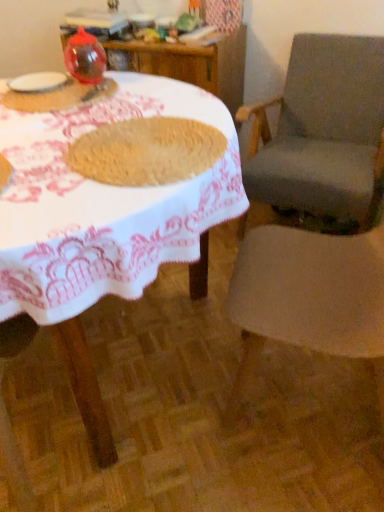
Where is `gray fabric chair at right, acting as the 1th chair starting from the front`? The image size is (384, 512). gray fabric chair at right, acting as the 1th chair starting from the front is located at coordinates (306, 295).

Identify the location of gray fabric chair at right, marked as the first chair in a back-to-front arrangement. This screenshot has width=384, height=512. (321, 129).

What is the approximate width of white woven table at center?

The width of white woven table at center is 1.21 meters.

Consider the image. Measure the distance between point (68, 61) and camera.

5.05 feet.

The image size is (384, 512). I want to click on translucent plastic cup at upper left, which appears as the first tableware when ordered from the bottom, so click(x=59, y=96).

From a real-world perspective, which object stands above the other?

transparent plastic balloon at upper left, which is counted as the 1th tableware, starting from the top, from a real-world perspective.

Considering the points (280, 98) and (97, 64), which point is in front, point (280, 98) or point (97, 64)?

The point (97, 64) is closer.

Is gray fabric chair at right, which ranks as the 2th chair in front-to-back order, facing towards transparent plastic balloon at upper left, placed as the third tableware when sorted from bottom to top?

No, gray fabric chair at right, which ranks as the 2th chair in front-to-back order, is not oriented towards transparent plastic balloon at upper left, placed as the third tableware when sorted from bottom to top.

Is white matte plate at upper left, marked as the 2th tableware in a bottom-to-top arrangement, directly adjacent to transparent plastic balloon at upper left, which is counted as the 1th tableware, starting from the top?

white matte plate at upper left, marked as the 2th tableware in a bottom-to-top arrangement, and transparent plastic balloon at upper left, which is counted as the 1th tableware, starting from the top, are clearly separated.

Between white matte plate at upper left, which is the 2th tableware from top to bottom, and transparent plastic balloon at upper left, which is counted as the 1th tableware, starting from the top, which one is positioned in front?

transparent plastic balloon at upper left, which is counted as the 1th tableware, starting from the top.

Is white matte plate at upper left, which is the 2th tableware from top to bottom, positioned with its back to transparent plastic balloon at upper left, placed as the third tableware when sorted from bottom to top?

Yes, transparent plastic balloon at upper left, placed as the third tableware when sorted from bottom to top, is at the back of white matte plate at upper left, which is the 2th tableware from top to bottom.

From the image's perspective, is translucent plastic cup at upper left, the 3th tableware in the top-to-bottom sequence, under gray fabric chair at right, marked as the first chair in a back-to-front arrangement?

No, from the image's perspective, translucent plastic cup at upper left, the 3th tableware in the top-to-bottom sequence, is not below gray fabric chair at right, marked as the first chair in a back-to-front arrangement.

Find the location of a particular element. the 1st tableware positioned above the gray fabric chair at right, marked as the first chair in a back-to-front arrangement (from a real-world perspective) is located at coordinates (59, 96).

Is point (10, 98) farther from camera compared to point (293, 118)?

No.

Between translucent plastic cup at upper left, which appears as the first tableware when ordered from the bottom, and gray fabric chair at right, marked as the first chair in a back-to-front arrangement, which one has smaller size?

translucent plastic cup at upper left, which appears as the first tableware when ordered from the bottom.

From the picture: Is brown woven mat at center facing towards gray fabric chair at right, which ranks as the 2th chair in front-to-back order?

No.

Consider the image. Considering the relative positions of brown woven mat at center and gray fabric chair at right, marked as the first chair in a back-to-front arrangement, in the image provided, is brown woven mat at center in front of gray fabric chair at right, marked as the first chair in a back-to-front arrangement,?

That is True.

Can you confirm if brown woven mat at center is positioned to the right of gray fabric chair at right, marked as the first chair in a back-to-front arrangement?

In fact, brown woven mat at center is to the left of gray fabric chair at right, marked as the first chair in a back-to-front arrangement.

Is brown woven mat at center bigger than gray fabric chair at right, marked as the first chair in a back-to-front arrangement?

Actually, brown woven mat at center might be smaller than gray fabric chair at right, marked as the first chair in a back-to-front arrangement.

Looking at their sizes, would you say transparent plastic balloon at upper left, which is counted as the 1th tableware, starting from the top, is wider or thinner than white woven table at center?

Clearly, transparent plastic balloon at upper left, which is counted as the 1th tableware, starting from the top, has less width compared to white woven table at center.

Between transparent plastic balloon at upper left, placed as the third tableware when sorted from bottom to top, and white woven table at center, which one has less height?

With less height is transparent plastic balloon at upper left, placed as the third tableware when sorted from bottom to top.

Is transparent plastic balloon at upper left, which is counted as the 1th tableware, starting from the top, situated inside white woven table at center or outside?

transparent plastic balloon at upper left, which is counted as the 1th tableware, starting from the top, is outside white woven table at center.

There is a white woven table at center. Where is `the 3rd tableware above it (from the image's perspective)`? the 3rd tableware above it (from the image's perspective) is located at coordinates (85, 57).

Looking at their sizes, would you say brown woven mat at center is wider or thinner than gray fabric chair at right, acting as the 1th chair starting from the front?

brown woven mat at center is thinner than gray fabric chair at right, acting as the 1th chair starting from the front.

Based on the photo, can you tell me how much brown woven mat at center and gray fabric chair at right, acting as the 1th chair starting from the front, differ in facing direction?

They differ by 1.41 degrees in their facing directions.

From a real-world perspective, who is located lower, brown woven mat at center or gray fabric chair at right, acting as the 1th chair starting from the front?

In real-world perspective, gray fabric chair at right, acting as the 1th chair starting from the front, is lower.

Is brown woven mat at center not close to gray fabric chair at right, the 2th chair when ordered from back to front?

No, brown woven mat at center is in close proximity to gray fabric chair at right, the 2th chair when ordered from back to front.

Which object is thinner, translucent plastic cup at upper left, the 3th tableware in the top-to-bottom sequence, or brown woven mat at center?

brown woven mat at center is thinner.

Is point (32, 103) closer to camera compared to point (81, 169)?

No, (32, 103) is further to viewer.

Locate an element on the screen. The width and height of the screenshot is (384, 512). food below the translucent plastic cup at upper left, the 3th tableware in the top-to-bottom sequence (from the image's perspective) is located at coordinates (146, 151).

Looking at this image, from the image's perspective, which is above, translucent plastic cup at upper left, the 3th tableware in the top-to-bottom sequence, or brown woven mat at center?

translucent plastic cup at upper left, the 3th tableware in the top-to-bottom sequence, appears higher in the image.

Where is `the 2nd chair positioned below the transparent plastic balloon at upper left, placed as the third tableware when sorted from bottom to top (from a real-world perspective)`? This screenshot has width=384, height=512. the 2nd chair positioned below the transparent plastic balloon at upper left, placed as the third tableware when sorted from bottom to top (from a real-world perspective) is located at coordinates (321, 129).

Where is `tableware above the white matte plate at upper left, marked as the 2th tableware in a bottom-to-top arrangement (from a real-world perspective)`? tableware above the white matte plate at upper left, marked as the 2th tableware in a bottom-to-top arrangement (from a real-world perspective) is located at coordinates (85, 57).

Estimate the real-world distances between objects in this image. Which object is closer to brown woven mat at center, transparent plastic balloon at upper left, placed as the third tableware when sorted from bottom to top, or white matte plate at upper left, marked as the 2th tableware in a bottom-to-top arrangement?

transparent plastic balloon at upper left, placed as the third tableware when sorted from bottom to top, is positioned closer to the anchor brown woven mat at center.

Which object lies further to the anchor point gray fabric chair at right, the 2th chair when ordered from back to front, gray fabric chair at right, which ranks as the 2th chair in front-to-back order, or translucent plastic cup at upper left, the 3th tableware in the top-to-bottom sequence?

The object further to gray fabric chair at right, the 2th chair when ordered from back to front, is translucent plastic cup at upper left, the 3th tableware in the top-to-bottom sequence.

Considering their positions, is gray fabric chair at right, the 2th chair when ordered from back to front, positioned further to white woven table at center than transparent plastic balloon at upper left, which is counted as the 1th tableware, starting from the top?

transparent plastic balloon at upper left, which is counted as the 1th tableware, starting from the top, is positioned further to the anchor white woven table at center.

Considering their positions, is white matte plate at upper left, which is the 2th tableware from top to bottom, positioned further to gray fabric chair at right, which ranks as the 2th chair in front-to-back order, than transparent plastic balloon at upper left, which is counted as the 1th tableware, starting from the top?

white matte plate at upper left, which is the 2th tableware from top to bottom, is further to gray fabric chair at right, which ranks as the 2th chair in front-to-back order.

In the scene shown: Which object lies further to the anchor point white matte plate at upper left, marked as the 2th tableware in a bottom-to-top arrangement, transparent plastic balloon at upper left, placed as the third tableware when sorted from bottom to top, or translucent plastic cup at upper left, which appears as the first tableware when ordered from the bottom?

transparent plastic balloon at upper left, placed as the third tableware when sorted from bottom to top, is positioned further to the anchor white matte plate at upper left, marked as the 2th tableware in a bottom-to-top arrangement.

Which object lies nearer to the anchor point white woven table at center, gray fabric chair at right, which ranks as the 2th chair in front-to-back order, or white matte plate at upper left, which is the 2th tableware from top to bottom?

white matte plate at upper left, which is the 2th tableware from top to bottom.

When comparing their distances from translucent plastic cup at upper left, which appears as the first tableware when ordered from the bottom, does white woven table at center or brown woven mat at center seem further?

brown woven mat at center lies further to translucent plastic cup at upper left, which appears as the first tableware when ordered from the bottom, than the other object.

Looking at the image, which one is located closer to translucent plastic cup at upper left, the 3th tableware in the top-to-bottom sequence, gray fabric chair at right, the 2th chair when ordered from back to front, or white matte plate at upper left, which is the 2th tableware from top to bottom?

white matte plate at upper left, which is the 2th tableware from top to bottom, lies closer to translucent plastic cup at upper left, the 3th tableware in the top-to-bottom sequence, than the other object.

The height and width of the screenshot is (512, 384). Find the location of `chair between translucent plastic cup at upper left, the 3th tableware in the top-to-bottom sequence, and gray fabric chair at right, marked as the first chair in a back-to-front arrangement, from left to right`. chair between translucent plastic cup at upper left, the 3th tableware in the top-to-bottom sequence, and gray fabric chair at right, marked as the first chair in a back-to-front arrangement, from left to right is located at coordinates (306, 295).

The width and height of the screenshot is (384, 512). In order to click on food between white woven table at center and translucent plastic cup at upper left, the 3th tableware in the top-to-bottom sequence, from front to back in this screenshot , I will do `click(146, 151)`.

Where is `food between white woven table at center and transparent plastic balloon at upper left, which is counted as the 1th tableware, starting from the top, in the front-back direction`? Image resolution: width=384 pixels, height=512 pixels. food between white woven table at center and transparent plastic balloon at upper left, which is counted as the 1th tableware, starting from the top, in the front-back direction is located at coordinates (146, 151).

Where is `table situated between white matte plate at upper left, marked as the 2th tableware in a bottom-to-top arrangement, and gray fabric chair at right, marked as the first chair in a back-to-front arrangement, from left to right`? table situated between white matte plate at upper left, marked as the 2th tableware in a bottom-to-top arrangement, and gray fabric chair at right, marked as the first chair in a back-to-front arrangement, from left to right is located at coordinates (100, 221).